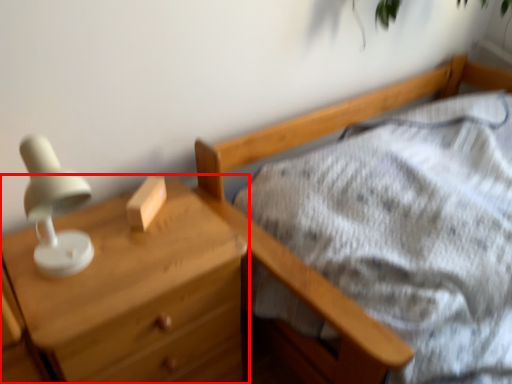
Question: Observing the image, what is the correct spatial positioning of chest of drawers (annotated by the red box) in reference to block?

Choices:
 (A) left
 (B) right

Answer: (A)